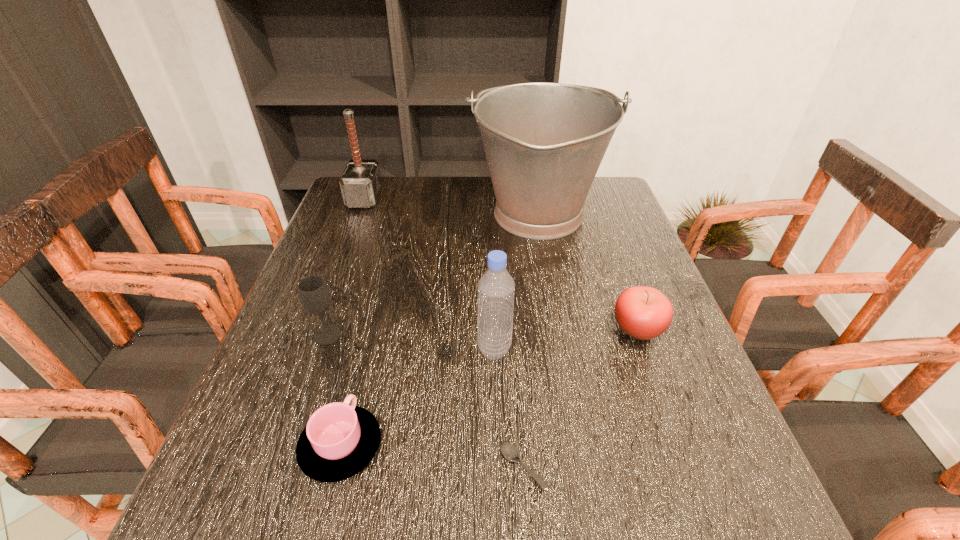
Locate an element on the screen. This screenshot has height=540, width=960. bucket is located at coordinates (544, 142).

This screenshot has height=540, width=960. In order to click on hammer in this screenshot , I will do `click(361, 183)`.

Where is `bottle`? The height and width of the screenshot is (540, 960). bottle is located at coordinates (496, 288).

I want to click on wineglass, so click(313, 292).

Locate an element on the screen. apple is located at coordinates (644, 313).

Identify the location of the sixth tallest object. (339, 440).

Locate an element on the screen. Image resolution: width=960 pixels, height=540 pixels. the shortest object is located at coordinates (510, 451).

Identify the location of blank area located 0.060m on the left of the tallest object. The image size is (960, 540). (446, 216).

Image resolution: width=960 pixels, height=540 pixels. What are the coordinates of `vacant area located 0.220m on the front of the hammer` in the screenshot? It's located at (342, 259).

Identify the location of free space located 0.080m on the left of the bottle. This screenshot has width=960, height=540. (438, 349).